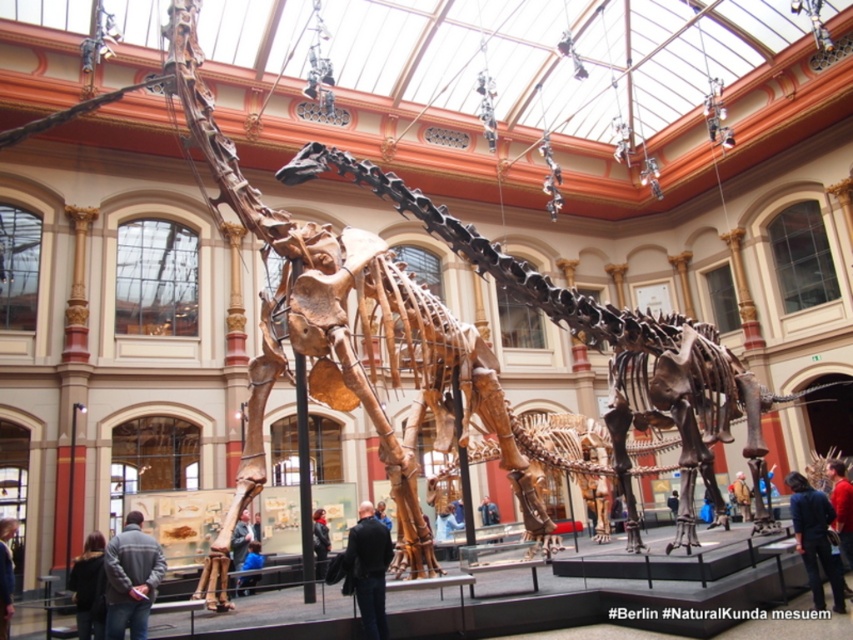
Question: Estimate the real-world distances between objects in this image. Which object is farther from the dark blue jacket at center?

Choices:
 (A) camouflage jacket at lower right
 (B) dark blue jeans at center
 (C) blue fabric jacket at center
 (D) blue jeans at center

Answer: (B)

Question: Which of the following is the closest to the observer?

Choices:
 (A) (672, 509)
 (B) (152, 568)
 (C) (233, 550)
 (D) (76, 611)

Answer: (B)

Question: Which of the following is the closest to the observer?

Choices:
 (A) red shirt at center
 (B) dark blue fabric jacket at lower right
 (C) camouflage jacket at lower right

Answer: (B)

Question: Is brown bone-like skeleton at center thinner than blue jeans at center?

Choices:
 (A) no
 (B) yes

Answer: (A)

Question: Is dark gray jacket at lower left to the right of camouflage jacket at lower right from the viewer's perspective?

Choices:
 (A) no
 (B) yes

Answer: (A)

Question: Is the position of dark blue fabric jacket at lower right more distant than that of dark blue jeans at center?

Choices:
 (A) no
 (B) yes

Answer: (B)